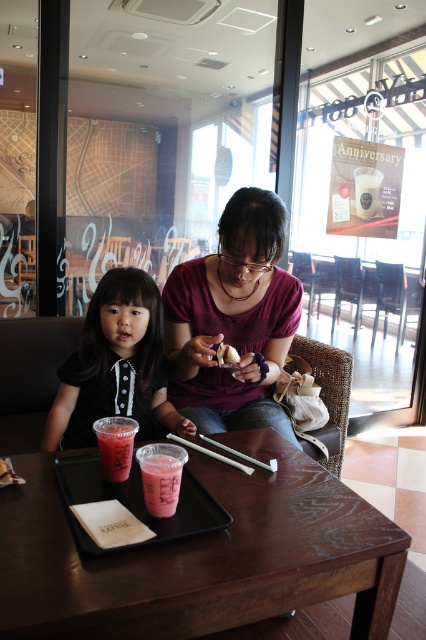
Between matte plastic cup at upper right and metallic silver chopsticks at center, which one has less height?

Standing shorter between the two is metallic silver chopsticks at center.

Measure the distance between point (360, 202) and camera.

The distance of point (360, 202) from camera is 3.18 meters.

Find the location of a particular element. matte plastic cup at upper right is located at coordinates (367, 189).

Between metallic silver chopsticks at center and white glossy donut at center, which one appears on the right side from the viewer's perspective?

From the viewer's perspective, metallic silver chopsticks at center appears more on the right side.

Who is shorter, metallic silver chopsticks at center or white glossy donut at center?

Standing shorter between the two is metallic silver chopsticks at center.

At what (x,y) coordinates should I click in order to perform the action: click on metallic silver chopsticks at center. Please return your answer as a coordinate pair (x, y). Looking at the image, I should click on (241, 454).

Is black matte shirt at left taller than green matte chopsticks at center?

Yes, black matte shirt at left is taller than green matte chopsticks at center.

Which is in front, point (106, 355) or point (181, 440)?

Point (181, 440)

Who is more forward, (108,388) or (193,444)?

Positioned in front is point (193,444).

Locate an element on the screen. This screenshot has height=640, width=426. black matte shirt at left is located at coordinates (115, 365).